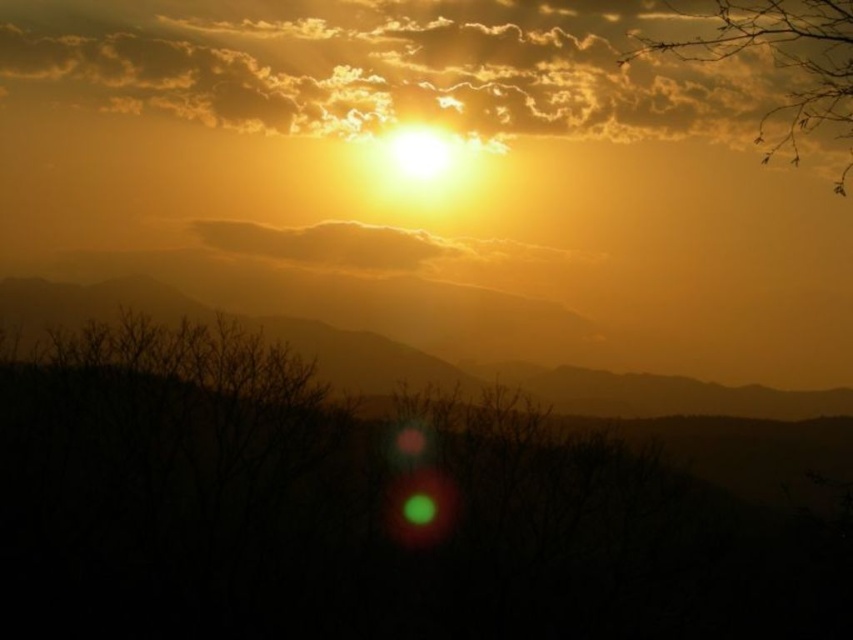
Between silhouette bark tree at lower left and silhouetted mountain at center, which one appears on the left side from the viewer's perspective?

Positioned to the left is silhouette bark tree at lower left.

Does silhouette bark tree at lower left lie behind silhouetted mountain at center?

No.

Locate an element on the screen. The height and width of the screenshot is (640, 853). silhouette bark tree at lower left is located at coordinates (360, 513).

At what (x,y) coordinates should I click in order to perform the action: click on silhouette bark tree at lower left. Please return your answer as a coordinate pair (x, y). This screenshot has width=853, height=640. Looking at the image, I should click on (360, 513).

This screenshot has width=853, height=640. Describe the element at coordinates (531, 378) in the screenshot. I see `silhouetted mountain at center` at that location.

Describe the element at coordinates (531, 378) in the screenshot. This screenshot has height=640, width=853. I see `silhouetted mountain at center` at that location.

Find the location of a particular element. silhouetted mountain at center is located at coordinates (531, 378).

Between silhouette bark tree at lower left and silvery branches at upper right, which one is positioned higher?

Positioned higher is silvery branches at upper right.

Where is `silhouette bark tree at lower left`? This screenshot has height=640, width=853. silhouette bark tree at lower left is located at coordinates (360, 513).

Between point (239, 424) and point (824, 68), which one is positioned in front?

Point (824, 68)

Locate an element on the screen. silhouette bark tree at lower left is located at coordinates [360, 513].